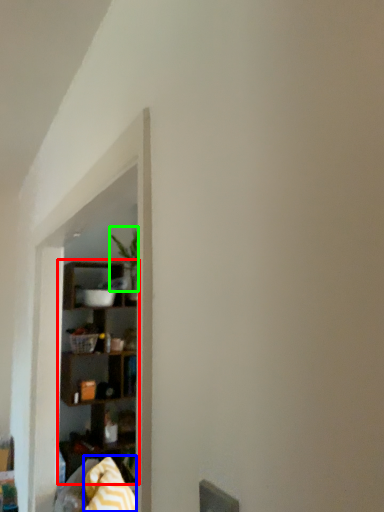
Question: Which is nearer to the shelf (highlighted by a red box)? blanket (highlighted by a blue box) or plant (highlighted by a green box).

Choices:
 (A) blanket
 (B) plant

Answer: (B)